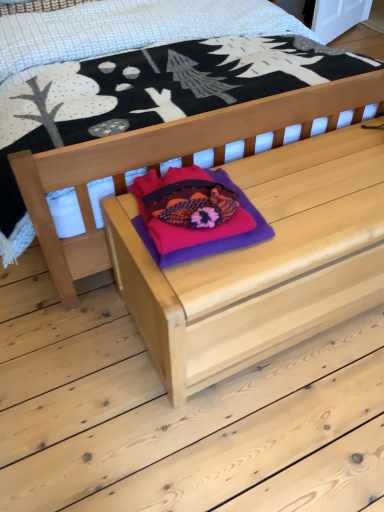
Question: Considering the relative positions of natural wood chest at center and purple felt throw pillow at center in the image provided, is natural wood chest at center to the left of purple felt throw pillow at center from the viewer's perspective?

Choices:
 (A) yes
 (B) no

Answer: (B)

Question: Can you see natural wood chest at center touching purple felt throw pillow at center?

Choices:
 (A) yes
 (B) no

Answer: (B)

Question: Is natural wood chest at center positioned beyond the bounds of purple felt throw pillow at center?

Choices:
 (A) yes
 (B) no

Answer: (A)

Question: Is natural wood chest at center at the right side of purple felt throw pillow at center?

Choices:
 (A) no
 (B) yes

Answer: (B)

Question: From the image's perspective, is natural wood chest at center on top of purple felt throw pillow at center?

Choices:
 (A) yes
 (B) no

Answer: (B)

Question: Can you confirm if natural wood chest at center is wider than purple felt throw pillow at center?

Choices:
 (A) yes
 (B) no

Answer: (A)

Question: Is the depth of natural wood chest at center less than that of natural wood bed at center?

Choices:
 (A) yes
 (B) no

Answer: (B)

Question: Is natural wood chest at center turned away from natural wood bed at center?

Choices:
 (A) yes
 (B) no

Answer: (A)

Question: Does natural wood chest at center have a lesser height compared to natural wood bed at center?

Choices:
 (A) yes
 (B) no

Answer: (A)

Question: Is natural wood chest at center aimed at natural wood bed at center?

Choices:
 (A) yes
 (B) no

Answer: (B)

Question: From a real-world perspective, is natural wood chest at center on natural wood bed at center?

Choices:
 (A) yes
 (B) no

Answer: (B)

Question: Is natural wood chest at center next to natural wood bed at center and touching it?

Choices:
 (A) yes
 (B) no

Answer: (B)

Question: Considering the relative positions of purple felt throw pillow at center and natural wood bed at center in the image provided, is purple felt throw pillow at center behind natural wood bed at center?

Choices:
 (A) yes
 (B) no

Answer: (A)